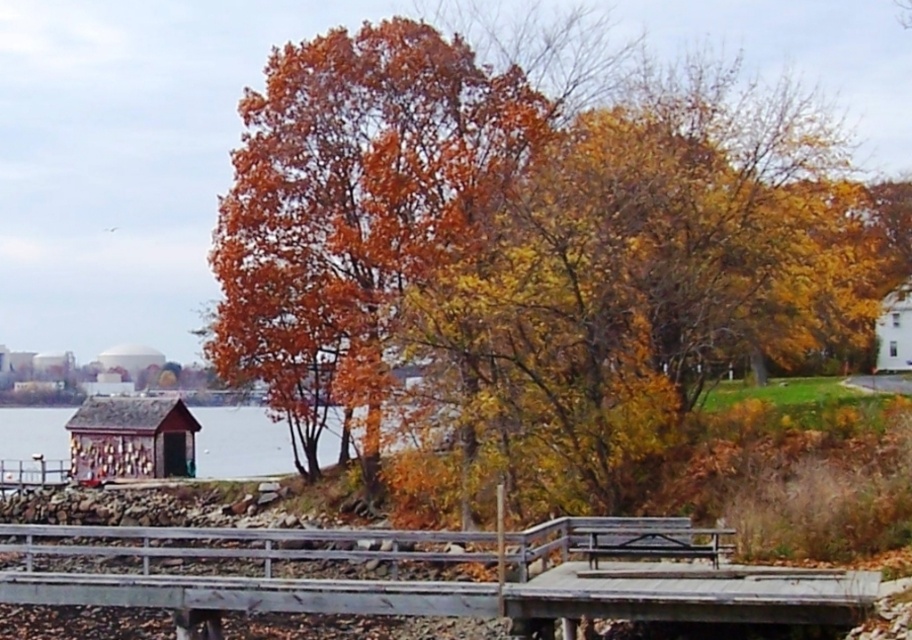
You are a hiker carrying a large backpack and need to cross either the gray wooden bridge at lower center or the smooth wooden dock at lower left. Which structure can support your weight more safely based on their widths?

The smooth wooden dock at lower left can support your weight more safely because it has a greater width than the gray wooden bridge at lower center, as stated in the description.

You are standing on the smooth wooden dock at lower left and want to look at the orange matte tree at center. In which direction should you turn your head to see it?

The orange matte tree at center is located above the smooth wooden dock at lower left, so you should look upwards to see it.